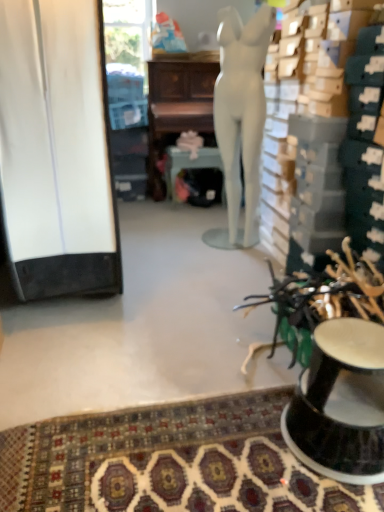
What are the coordinates of `blank space to the left of white matte mannequin at center` in the screenshot? It's located at (190, 249).